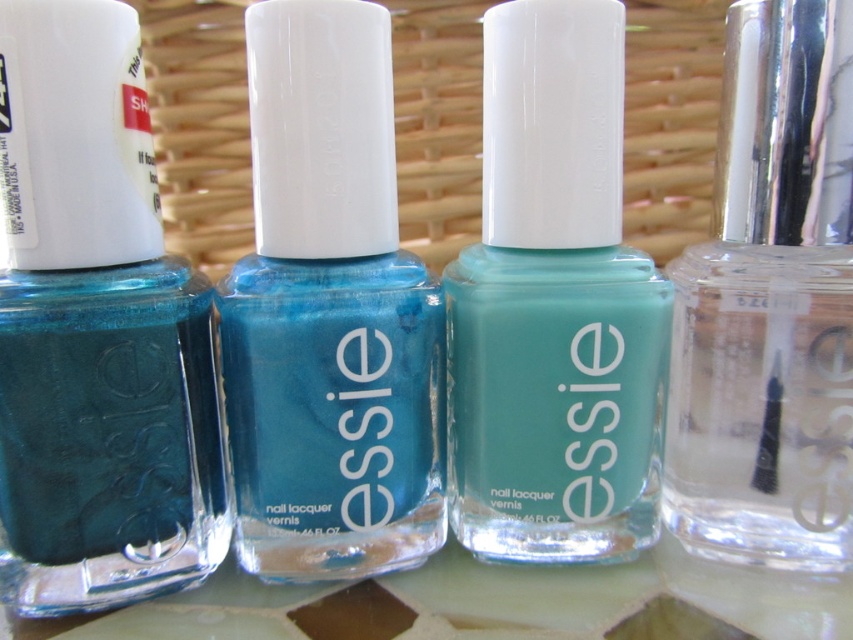
You are organizing a beauty store shelf and need to place a new nail polish bottle at coordinate point 0.5, 0.1. There is already a teal glossy nail polish at left on the shelf. Can you place the new bottle at the desired coordinate without overlapping?

The teal glossy nail polish at left is already at position (96,330), which is very close to the desired coordinate (84,320). Depending on the size of the new bottle and the spacing between items, there might be a slight overlap. To ensure no overlap, check the exact dimensions and spacing requirements before placing the new bottle.

You are organizing a beauty store shelf and need to place the shiny teal nail polish at center. The shelf has a grid system with coordinates from 0 to 1 in both x and y directions. Where should you place it based on its 2D coordinates?

The shiny teal nail polish at center should be placed at the coordinates 0.491 in the x direction and 0.387 in the y direction on the shelf grid system.

Based on the photo, you are organizing a beauty store shelf and need to place the matte glass nail polish at center and the clear glass nail polish at right. If the shelf has limited space, which bottle should you prioritize placing first to ensure both fit?

The clear glass nail polish at right should be placed first since it is smaller in size than the matte glass nail polish at center, allowing more space for the larger bottle afterward.